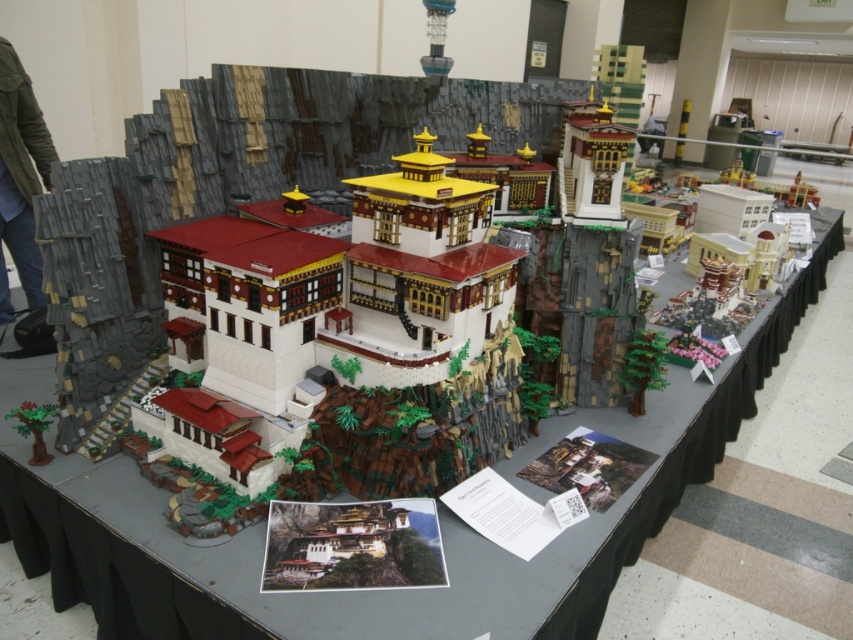
Question: Is the position of white lego structure at center less distant than that of matte gray bricks at left?

Choices:
 (A) yes
 (B) no

Answer: (A)

Question: Which object is farther from the camera taking this photo?

Choices:
 (A) matte gray bricks at left
 (B) white lego structure at center

Answer: (A)

Question: Does white lego structure at center appear under matte gray bricks at left?

Choices:
 (A) yes
 (B) no

Answer: (A)

Question: Does white lego structure at center lie in front of matte gray bricks at left?

Choices:
 (A) no
 (B) yes

Answer: (B)

Question: Which object appears farthest from the camera in this image?

Choices:
 (A) matte gray bricks at left
 (B) white lego structure at center

Answer: (A)

Question: Which point is closer to the camera?

Choices:
 (A) matte gray bricks at left
 (B) white lego structure at center

Answer: (B)